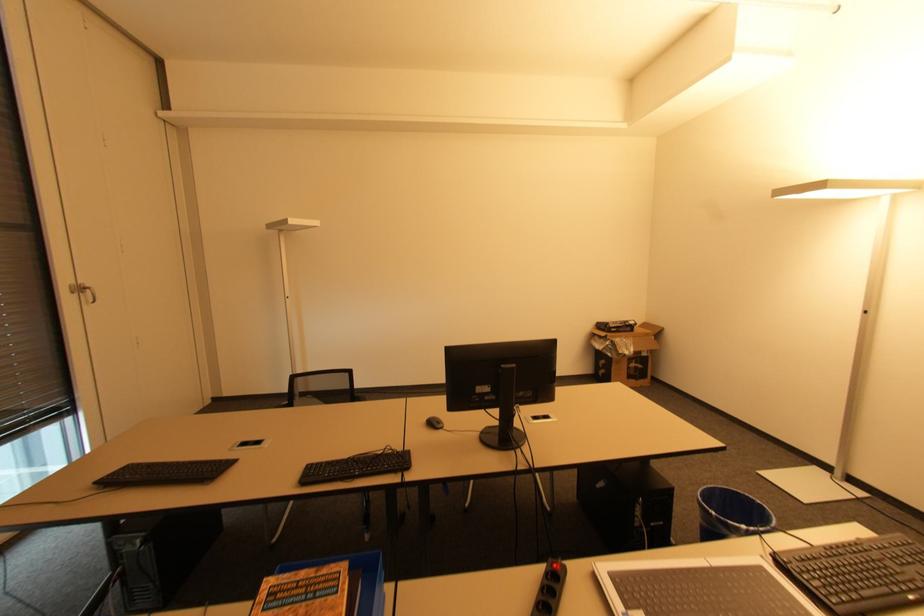
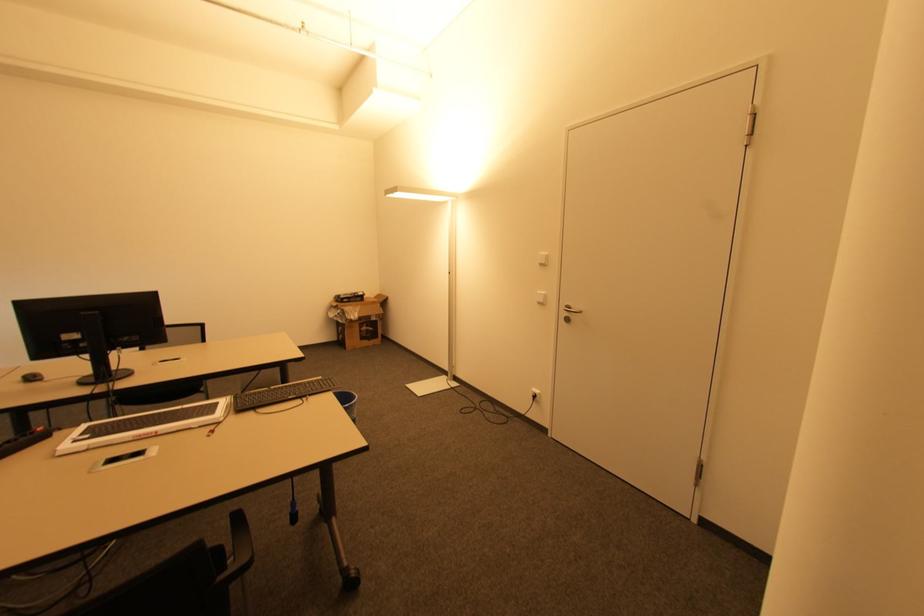
Where in the second image is the point corresponding to pixel 638 368 from the first image?

(369, 331)